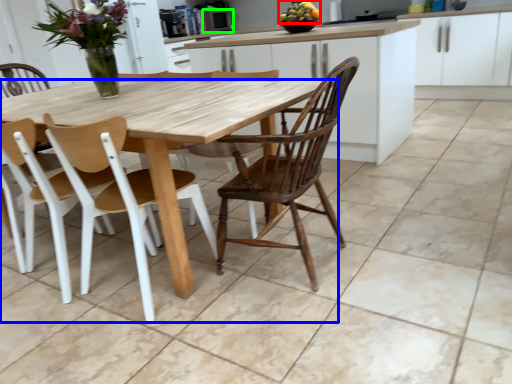
Question: Based on their relative distances, which object is nearer to fruit (highlighted by a red box)? Choose from table (highlighted by a blue box) and appliance (highlighted by a green box).

Choices:
 (A) table
 (B) appliance

Answer: (B)